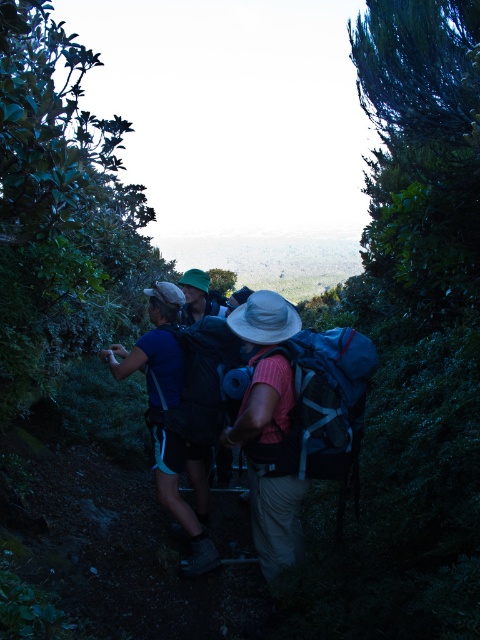
Question: Which point is farther to the camera?

Choices:
 (A) blue fabric backpack at center
 (B) matte black backpacks at center

Answer: (A)

Question: Estimate the real-world distances between objects in this image. Which object is closer to the matte black backpack at center?

Choices:
 (A) matte black backpacks at center
 (B) blue fabric backpack at center

Answer: (A)

Question: Is blue fabric backpack at center thinner than matte black backpack at center?

Choices:
 (A) no
 (B) yes

Answer: (A)

Question: Which of these objects is positioned closest to the matte black backpacks at center?

Choices:
 (A) matte black backpack at center
 (B) blue fabric backpack at center

Answer: (B)

Question: Can you confirm if blue fabric backpack at center is wider than matte black backpack at center?

Choices:
 (A) yes
 (B) no

Answer: (A)

Question: Does matte black backpacks at center appear over matte black backpack at center?

Choices:
 (A) no
 (B) yes

Answer: (A)